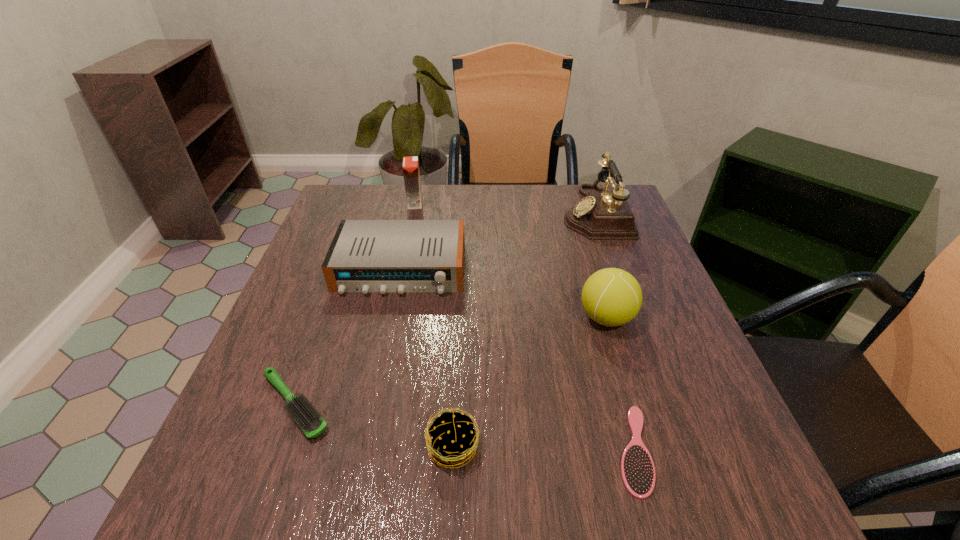
Where is `blank area located on the dial of the telephone`? The image size is (960, 540). blank area located on the dial of the telephone is located at coordinates (450, 212).

Locate an element on the screen. The width and height of the screenshot is (960, 540). vacant space located on the dial of the telephone is located at coordinates (480, 212).

What are the coordinates of `vacant space situated 0.120m on the right of the orange juice` in the screenshot? It's located at (466, 203).

The image size is (960, 540). I want to click on vacant point located on the back of the fourth nearest object, so click(592, 271).

At what (x,y) coordinates should I click in order to perform the action: click on vacant area located 0.350m on the control panel of the radio receiver. Please return your answer as a coordinate pair (x, y). Looking at the image, I should click on (362, 454).

At what (x,y) coordinates should I click in order to perform the action: click on vacant space located on the back of the patty. Please return your answer as a coordinate pair (x, y). This screenshot has width=960, height=540. Looking at the image, I should click on (457, 355).

Identify the location of vacant space located 0.080m on the front of the left hairbrush. (262, 495).

Identify the location of vacant area located on the back of the shortest object. (582, 261).

Locate an element on the screen. The height and width of the screenshot is (540, 960). telephone that is positioned at the far edge is located at coordinates (601, 215).

Where is `orange juice that is at the far edge`? orange juice that is at the far edge is located at coordinates (411, 174).